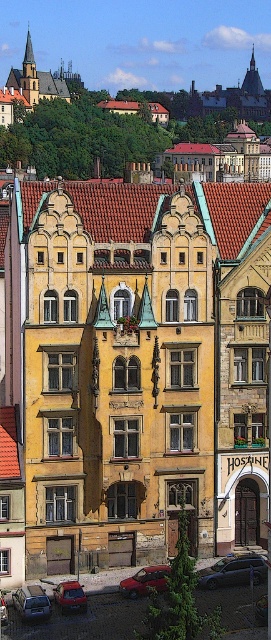
Is yellow stone building at center further to camera compared to metallic red car at lower left?

Yes, yellow stone building at center is behind metallic red car at lower left.

Does yellow stone building at center appear under metallic red car at lower left?

No, yellow stone building at center is not below metallic red car at lower left.

Where is `yellow stone building at center`? The width and height of the screenshot is (271, 640). yellow stone building at center is located at coordinates (104, 131).

The width and height of the screenshot is (271, 640). Describe the element at coordinates (146, 580) in the screenshot. I see `metallic red car at center` at that location.

Who is more forward, (x=131, y=593) or (x=81, y=605)?

Point (x=81, y=605) is in front.

Does point (140, 582) lie behind point (69, 605)?

Yes.

This screenshot has width=271, height=640. I want to click on metallic red car at center, so click(146, 580).

Between metallic red car at lower center and metallic red car at lower left, which one is positioned lower?

metallic red car at lower left is lower down.

Who is more forward, (x=78, y=604) or (x=4, y=616)?

Positioned in front is point (x=4, y=616).

Locate an element on the screen. The image size is (271, 640). metallic red car at lower center is located at coordinates (69, 596).